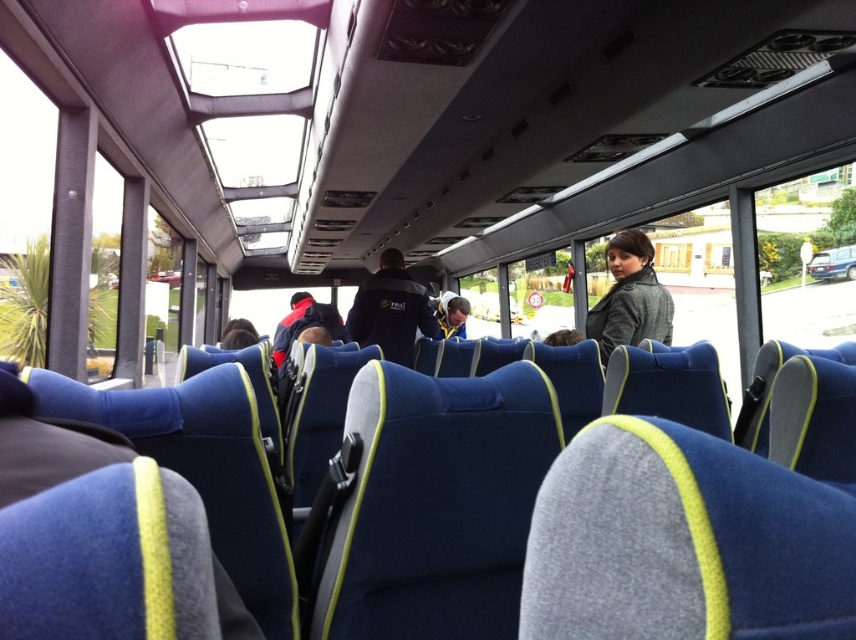
Between matte black jacket at upper right and dark blue fabric jacket at center, which one appears on the right side from the viewer's perspective?

From the viewer's perspective, matte black jacket at upper right appears more on the right side.

Can you confirm if matte black jacket at upper right is positioned below dark blue fabric jacket at center?

Correct, matte black jacket at upper right is located below dark blue fabric jacket at center.

Locate an element on the screen. Image resolution: width=856 pixels, height=640 pixels. matte black jacket at upper right is located at coordinates (629, 298).